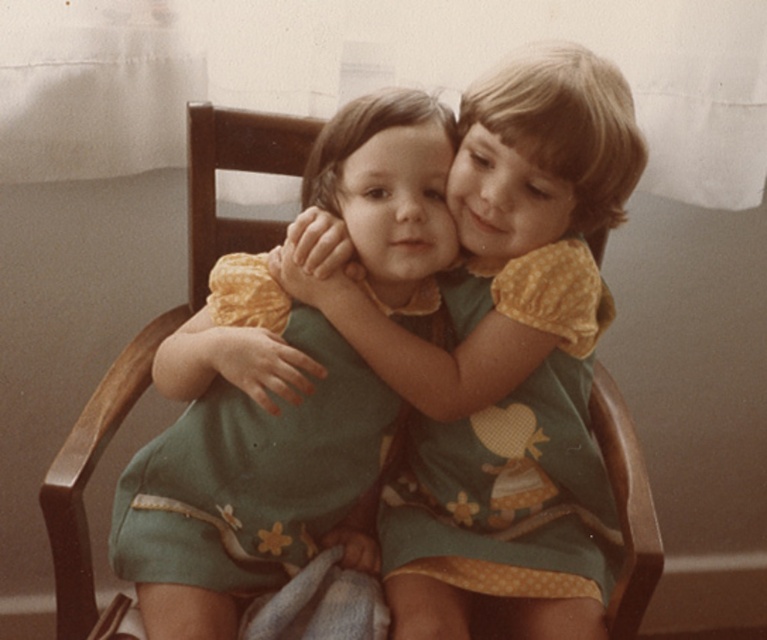
Question: Which of the following is the closest to the observer?

Choices:
 (A) click(x=492, y=104)
 (B) click(x=486, y=451)
 (C) click(x=364, y=179)

Answer: (A)

Question: Which point is closer to the camera taking this photo?

Choices:
 (A) (453, 241)
 (B) (514, 528)

Answer: (A)

Question: Is matte green dress at center to the right of green dotted dress at center from the viewer's perspective?

Choices:
 (A) yes
 (B) no

Answer: (B)

Question: Does green fabric dress at center have a smaller size compared to green dotted dress at center?

Choices:
 (A) no
 (B) yes

Answer: (A)

Question: Can you confirm if matte green dress at center is smaller than green fabric dress at center?

Choices:
 (A) yes
 (B) no

Answer: (B)

Question: Which object appears farthest from the camera in this image?

Choices:
 (A) green fabric dress at center
 (B) green dotted dress at center

Answer: (B)